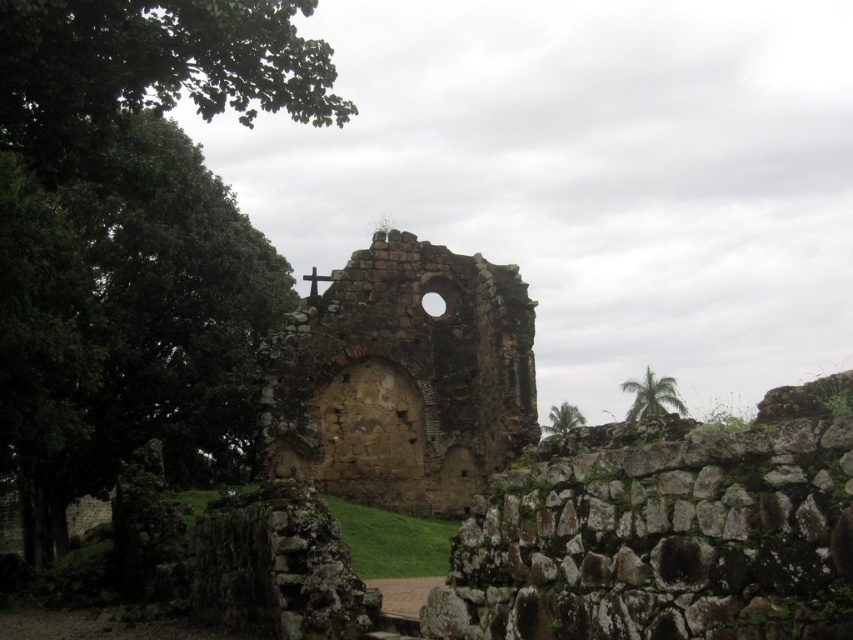
Question: Can you confirm if brown stone ruins at center is positioned below green leafy tree at upper right?

Choices:
 (A) no
 (B) yes

Answer: (A)

Question: Which point is farther to the camera?

Choices:
 (A) (462, 269)
 (B) (573, 422)

Answer: (B)

Question: Is green leafy tree at upper left in front of green leafy tree at upper right?

Choices:
 (A) yes
 (B) no

Answer: (A)

Question: Which is nearer to the green leafy tree at upper left?

Choices:
 (A) brown stone ruins at center
 (B) green leafy tree at upper right
 (C) green leafy palm at upper right

Answer: (A)

Question: Does green leafy palm at upper right appear on the left side of green leafy tree at upper right?

Choices:
 (A) yes
 (B) no

Answer: (B)

Question: Estimate the real-world distances between objects in this image. Which object is farther from the green leafy tree at upper left?

Choices:
 (A) green leafy palm at upper right
 (B) brown stone ruins at center
 (C) green leafy tree at upper right

Answer: (A)